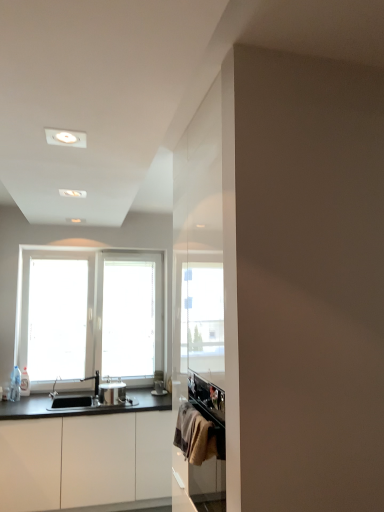
The width and height of the screenshot is (384, 512). Find the location of `free point behind satin nickel faucet at sink left`. free point behind satin nickel faucet at sink left is located at coordinates (91, 394).